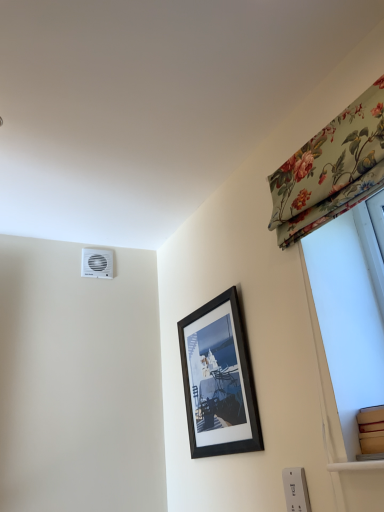
Question: Considering the relative sizes of black matte picture frame at center and white plastic electric outlet at lower right in the image provided, is black matte picture frame at center shorter than white plastic electric outlet at lower right?

Choices:
 (A) no
 (B) yes

Answer: (A)

Question: Are black matte picture frame at center and white plastic electric outlet at lower right beside each other?

Choices:
 (A) yes
 (B) no

Answer: (B)

Question: Considering the relative sizes of black matte picture frame at center and white plastic electric outlet at lower right in the image provided, is black matte picture frame at center wider than white plastic electric outlet at lower right?

Choices:
 (A) yes
 (B) no

Answer: (A)

Question: From the image's perspective, is black matte picture frame at center on white plastic electric outlet at lower right?

Choices:
 (A) no
 (B) yes

Answer: (B)

Question: Would you say black matte picture frame at center is outside white plastic electric outlet at lower right?

Choices:
 (A) no
 (B) yes

Answer: (B)

Question: Is white plastic electric outlet at lower right inside black matte picture frame at center?

Choices:
 (A) no
 (B) yes

Answer: (A)

Question: Is white plastic air conditioning unit at upper left positioned behind white plastic electric outlet at lower right?

Choices:
 (A) no
 (B) yes

Answer: (B)

Question: From the image's perspective, is white plastic air conditioning unit at upper left under white plastic electric outlet at lower right?

Choices:
 (A) no
 (B) yes

Answer: (A)

Question: From a real-world perspective, is white plastic air conditioning unit at upper left beneath white plastic electric outlet at lower right?

Choices:
 (A) yes
 (B) no

Answer: (B)

Question: Is white plastic air conditioning unit at upper left touching white plastic electric outlet at lower right?

Choices:
 (A) no
 (B) yes

Answer: (A)

Question: Is white plastic air conditioning unit at upper left positioned in front of white plastic electric outlet at lower right?

Choices:
 (A) no
 (B) yes

Answer: (A)

Question: Does white plastic air conditioning unit at upper left appear on the left side of white plastic electric outlet at lower right?

Choices:
 (A) yes
 (B) no

Answer: (A)

Question: Can you confirm if white plastic air conditioning unit at upper left is bigger than floral fabric curtain at upper right?

Choices:
 (A) yes
 (B) no

Answer: (B)